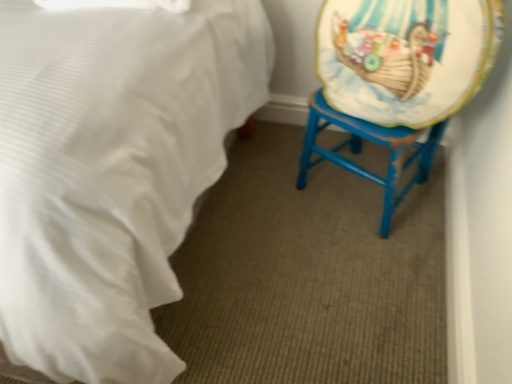
Question: Considering the relative sizes of matte plastic platter at right and blue painted wood swivel chair at right in the image provided, is matte plastic platter at right bigger than blue painted wood swivel chair at right?

Choices:
 (A) yes
 (B) no

Answer: (B)

Question: Is blue painted wood swivel chair at right at the back of matte plastic platter at right?

Choices:
 (A) no
 (B) yes

Answer: (B)

Question: Is matte plastic platter at right beside blue painted wood swivel chair at right?

Choices:
 (A) no
 (B) yes

Answer: (B)

Question: Are matte plastic platter at right and blue painted wood swivel chair at right far apart?

Choices:
 (A) yes
 (B) no

Answer: (B)

Question: Can you confirm if matte plastic platter at right is thinner than blue painted wood swivel chair at right?

Choices:
 (A) yes
 (B) no

Answer: (A)

Question: In the image, is blue painted wood swivel chair at right positioned in front of or behind white satin bed at lower left?

Choices:
 (A) behind
 (B) front

Answer: (A)

Question: Considering the positions of blue painted wood swivel chair at right and white satin bed at lower left in the image, is blue painted wood swivel chair at right bigger or smaller than white satin bed at lower left?

Choices:
 (A) big
 (B) small

Answer: (B)

Question: From a real-world perspective, relative to white satin bed at lower left, is blue painted wood swivel chair at right vertically above or below?

Choices:
 (A) above
 (B) below

Answer: (B)

Question: Considering the positions of blue painted wood swivel chair at right and white satin bed at lower left in the image, is blue painted wood swivel chair at right taller or shorter than white satin bed at lower left?

Choices:
 (A) short
 (B) tall

Answer: (A)

Question: From the image's perspective, is white satin bed at lower left positioned above or below blue painted wood swivel chair at right?

Choices:
 (A) above
 (B) below

Answer: (A)

Question: Is white satin bed at lower left situated inside blue painted wood swivel chair at right or outside?

Choices:
 (A) inside
 (B) outside

Answer: (B)

Question: Is white satin bed at lower left in front of or behind blue painted wood swivel chair at right in the image?

Choices:
 (A) behind
 (B) front

Answer: (B)

Question: From a real-world perspective, is white satin bed at lower left physically located above or below blue painted wood swivel chair at right?

Choices:
 (A) below
 (B) above

Answer: (B)

Question: In the image, is white satin bed at lower left on the left side or the right side of matte plastic platter at right?

Choices:
 (A) right
 (B) left

Answer: (B)

Question: Looking at their shapes, would you say white satin bed at lower left is wider or thinner than matte plastic platter at right?

Choices:
 (A) wide
 (B) thin

Answer: (A)